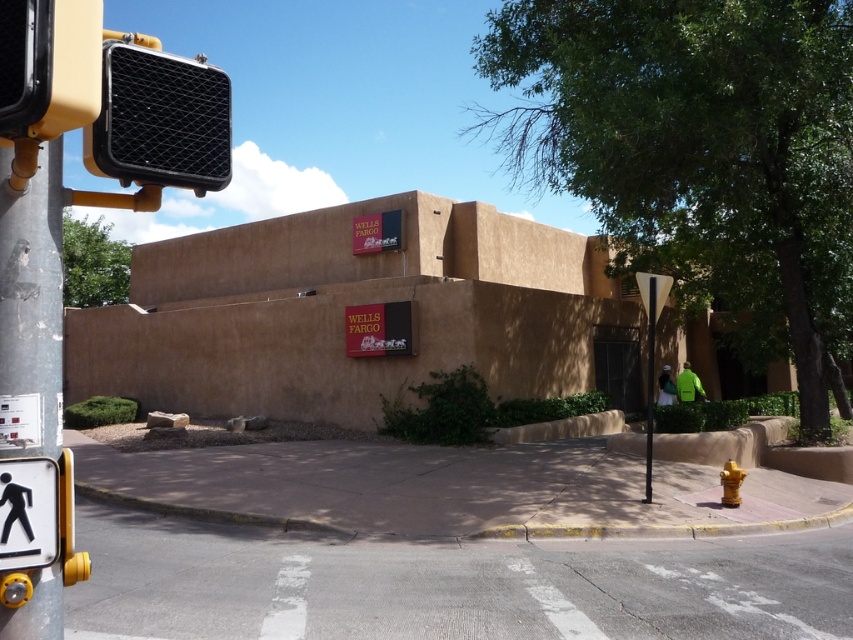
Can you confirm if black textured traffic light at upper left is smaller than white plastic pedestrian sign at lower left?

No.

Locate an element on the screen. black textured traffic light at upper left is located at coordinates (160, 120).

The height and width of the screenshot is (640, 853). Find the location of `black textured traffic light at upper left`. black textured traffic light at upper left is located at coordinates (160, 120).

Who is taller, black textured traffic light at upper left or yellow plastic traffic light at upper left?

black textured traffic light at upper left is taller.

Does black textured traffic light at upper left have a lesser height compared to yellow plastic traffic light at upper left?

No, black textured traffic light at upper left is not shorter than yellow plastic traffic light at upper left.

Is point (167, 154) positioned after point (0, 33)?

Yes, it is.

You are a GUI agent. You are given a task and a screenshot of the screen. Output one action in this format:
    pyautogui.click(x=<x>, y=<y>)
    Task: Click on the black textured traffic light at upper left
    The image size is (853, 640).
    Given the screenshot: What is the action you would take?
    pyautogui.click(x=160, y=120)

Is the position of black textured traffic light at upper left more distant than that of metallic silver street sign at center right?

No.

At what (x,y) coordinates should I click in order to perform the action: click on black textured traffic light at upper left. Please return your answer as a coordinate pair (x, y). Image resolution: width=853 pixels, height=640 pixels. Looking at the image, I should click on (160, 120).

What are the coordinates of `black textured traffic light at upper left` in the screenshot? It's located at (160, 120).